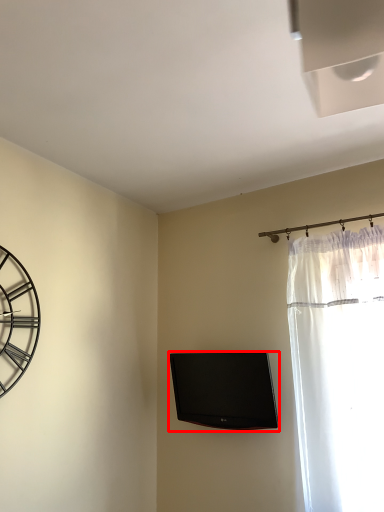
Question: Observing the image, what is the correct spatial positioning of television (annotated by the red box) in reference to wall clock?

Choices:
 (A) left
 (B) right

Answer: (B)